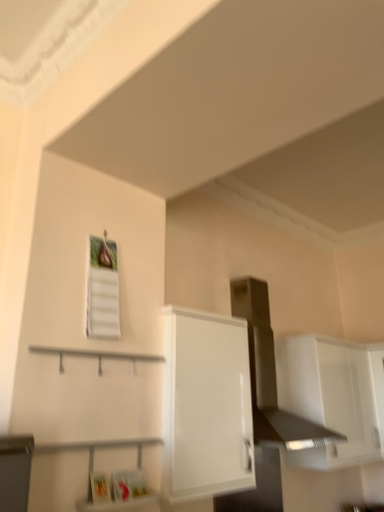
Question: Can you confirm if white glossy cabinet at upper right, the 1th cabinetry from the back, is wider than white glossy cabinet at center, the 2th cabinetry when ordered from back to front?

Choices:
 (A) yes
 (B) no

Answer: (A)

Question: Is white glossy cabinet at upper right, the second cabinetry when ordered from left to right, turned away from white glossy cabinet at center, the 2th cabinetry in the right-to-left sequence?

Choices:
 (A) no
 (B) yes

Answer: (A)

Question: Is white glossy cabinet at upper right, the 1th cabinetry from the back, bigger than white glossy cabinet at center, the 2th cabinetry when ordered from back to front?

Choices:
 (A) yes
 (B) no

Answer: (A)

Question: Is white glossy cabinet at upper right, the first cabinetry when ordered from right to left, positioned in front of white glossy cabinet at center, the 2th cabinetry in the right-to-left sequence?

Choices:
 (A) yes
 (B) no

Answer: (B)

Question: Is point (380, 366) positioned closer to the camera than point (240, 328)?

Choices:
 (A) farther
 (B) closer

Answer: (A)

Question: Is white glossy cabinet at upper right, the first cabinetry when ordered from right to left, to the left or to the right of white glossy cabinet at center, marked as the 1th cabinetry in a left-to-right arrangement, in the image?

Choices:
 (A) right
 (B) left

Answer: (A)

Question: In terms of size, does white glossy cabinet at upper right, the first cabinetry when ordered from right to left, appear bigger or smaller than white glossy cabinet at center, the 2th cabinetry in the right-to-left sequence?

Choices:
 (A) big
 (B) small

Answer: (A)

Question: In the image, is white glossy cabinet at upper right, the second cabinetry when ordered from left to right, positioned in front of or behind white glossy cabinet at center, the 2th cabinetry in the right-to-left sequence?

Choices:
 (A) front
 (B) behind

Answer: (B)

Question: Do you think white glossy cabinet at center, the 2th cabinetry when ordered from back to front, is within white glossy cabinet at upper right, the second cabinetry when ordered from left to right, or outside of it?

Choices:
 (A) inside
 (B) outside

Answer: (B)

Question: In terms of height, does white glossy cabinet at center, marked as the 1th cabinetry in a left-to-right arrangement, look taller or shorter compared to white glossy cabinet at upper right, marked as the 2th cabinetry in a front-to-back arrangement?

Choices:
 (A) tall
 (B) short

Answer: (A)

Question: Considering their positions, is white glossy cabinet at center, marked as the 1th cabinetry in a left-to-right arrangement, located in front of or behind white glossy cabinet at upper right, the 1th cabinetry from the back?

Choices:
 (A) behind
 (B) front

Answer: (B)

Question: From the image's perspective, is white glossy cabinet at center, marked as the 1th cabinetry in a left-to-right arrangement, above or below white glossy cabinet at upper right, the first cabinetry when ordered from right to left?

Choices:
 (A) above
 (B) below

Answer: (A)

Question: Looking at their shapes, would you say satin silver vent at upper center is wider or thinner than white glossy cabinet at center, the 2th cabinetry in the right-to-left sequence?

Choices:
 (A) thin
 (B) wide

Answer: (B)

Question: From their relative heights in the image, would you say satin silver vent at upper center is taller or shorter than white glossy cabinet at center, the 2th cabinetry when ordered from back to front?

Choices:
 (A) short
 (B) tall

Answer: (B)